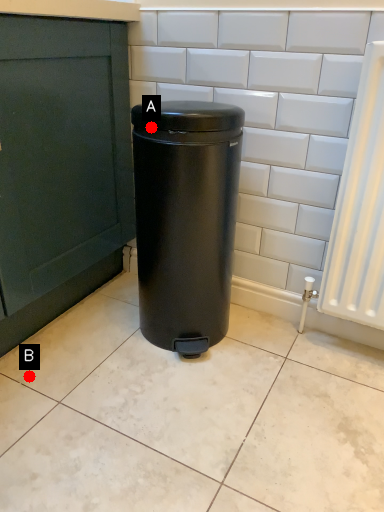
Question: Two points are circled on the image, labeled by A and B beside each circle. Which point appears farthest from the camera in this image?

Choices:
 (A) A is further
 (B) B is further

Answer: (B)